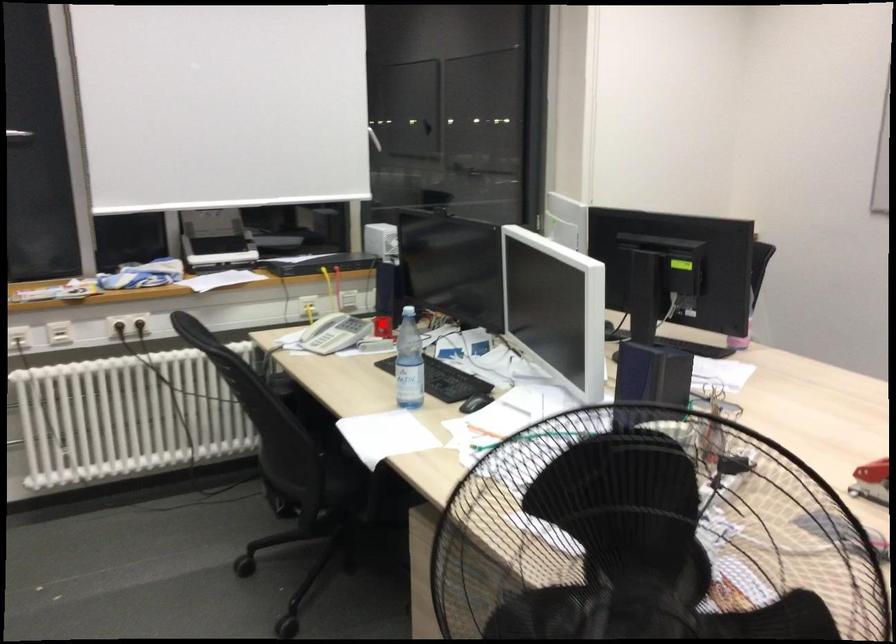
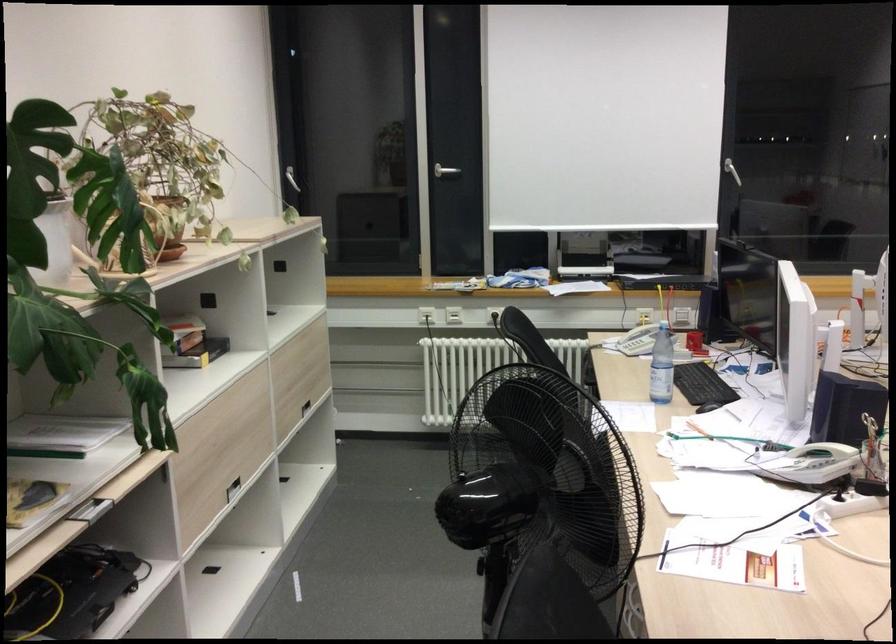
In the second image, find the point that corresponds to the highlighted location in the first image.

(694, 343)